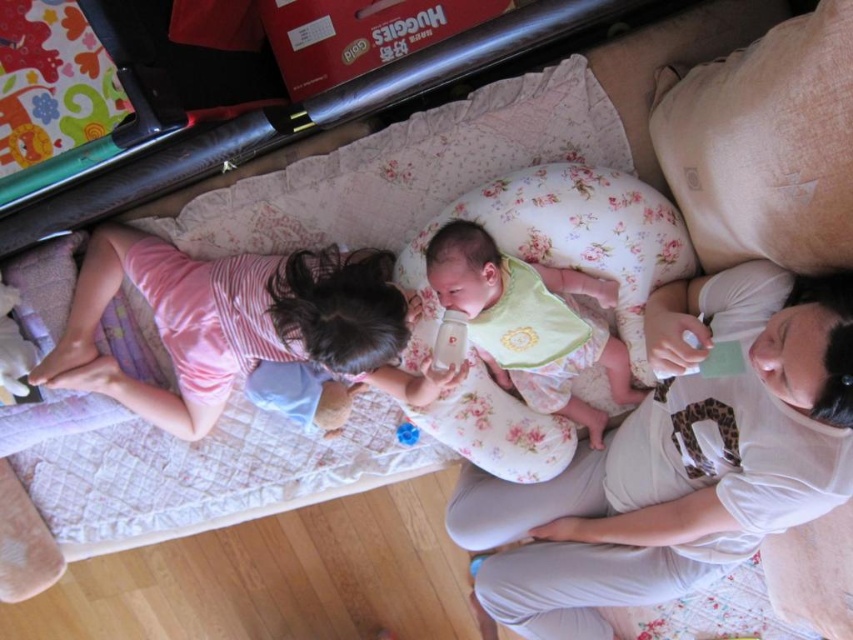
Question: Which is nearer to the floral fabric pillow at center?

Choices:
 (A) pink striped shirt at upper left
 (B) white cotton shirt at upper right
 (C) blue rubber duck at center

Answer: (B)

Question: Does white cotton shirt at upper right have a smaller size compared to blue rubber duck at center?

Choices:
 (A) no
 (B) yes

Answer: (A)

Question: Which point is farther to the camera?

Choices:
 (A) pink striped shirt at upper left
 (B) fluffy beige pillow at upper right
 (C) white cotton shirt at upper right
 (D) floral fabric pillow at center

Answer: (D)

Question: Which is farther from the pink striped shirt at upper left?

Choices:
 (A) soft white bib at center
 (B) floral fabric pillow at center

Answer: (B)

Question: Does fluffy beige pillow at upper right appear on the right side of soft white bib at center?

Choices:
 (A) no
 (B) yes

Answer: (B)

Question: Is pink striped shirt at upper left further to camera compared to blue rubber duck at center?

Choices:
 (A) no
 (B) yes

Answer: (A)